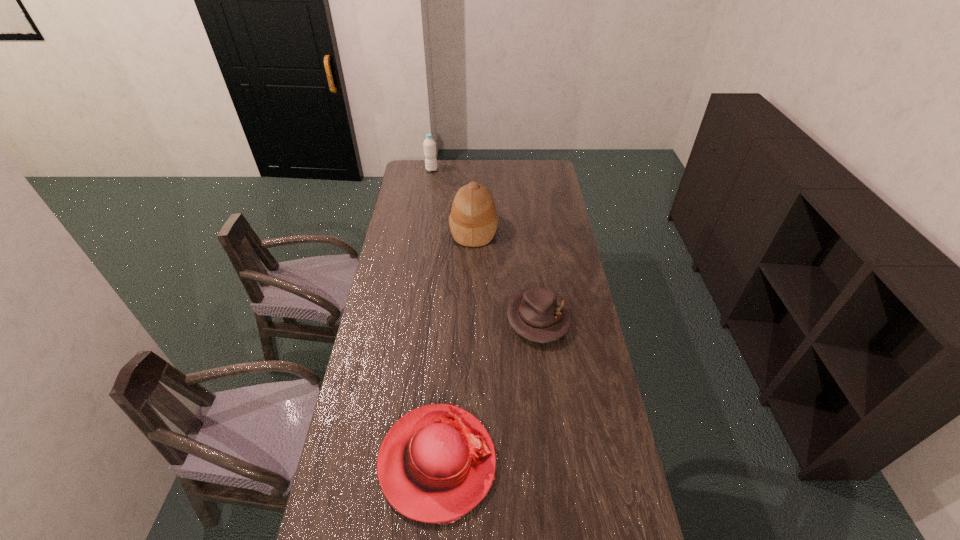
Image resolution: width=960 pixels, height=540 pixels. In order to click on free space between the nearest hat and the shortest object in this screenshot , I will do `click(488, 390)`.

Locate an element on the screen. free space between the second farthest object and the nearest hat is located at coordinates (455, 345).

Where is `free area in between the nearest object and the rightmost hat`? This screenshot has height=540, width=960. free area in between the nearest object and the rightmost hat is located at coordinates (488, 390).

Identify the location of blank region between the farthest hat and the second tallest hat. The height and width of the screenshot is (540, 960). (455, 345).

This screenshot has height=540, width=960. In order to click on vacant area between the third nearest object and the nearest object in this screenshot , I will do `click(455, 345)`.

The height and width of the screenshot is (540, 960). In order to click on empty location between the second shortest object and the shortest object in this screenshot , I will do `click(488, 390)`.

Locate an element on the screen. This screenshot has width=960, height=540. object that ranks as the closest to the rightmost hat is located at coordinates (437, 462).

Identify which object is the second closest to the farthest object. Please provide its 2D coordinates. Your answer should be formatted as a tuple, i.e. [(x, y)], where the tuple contains the x and y coordinates of a point satisfying the conditions above.

[(537, 314)]

Identify which hat is located as the second nearest to the shortest object. Please provide its 2D coordinates. Your answer should be formatted as a tuple, i.e. [(x, y)], where the tuple contains the x and y coordinates of a point satisfying the conditions above.

[(473, 221)]

Point out which hat is positioned as the nearest to the second farthest hat. Please provide its 2D coordinates. Your answer should be formatted as a tuple, i.e. [(x, y)], where the tuple contains the x and y coordinates of a point satisfying the conditions above.

[(437, 462)]